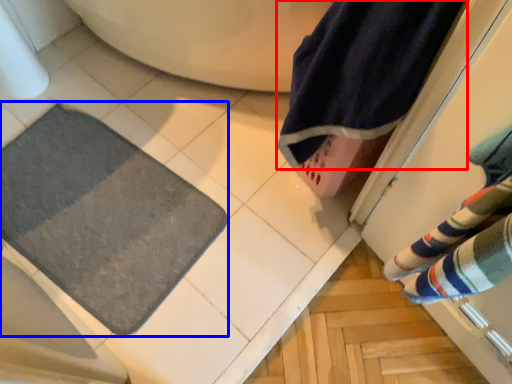
Question: Among these objects, which one is nearest to the camera, beach towel (highlighted by a red box) or bath mat (highlighted by a blue box)?

Choices:
 (A) beach towel
 (B) bath mat

Answer: (A)